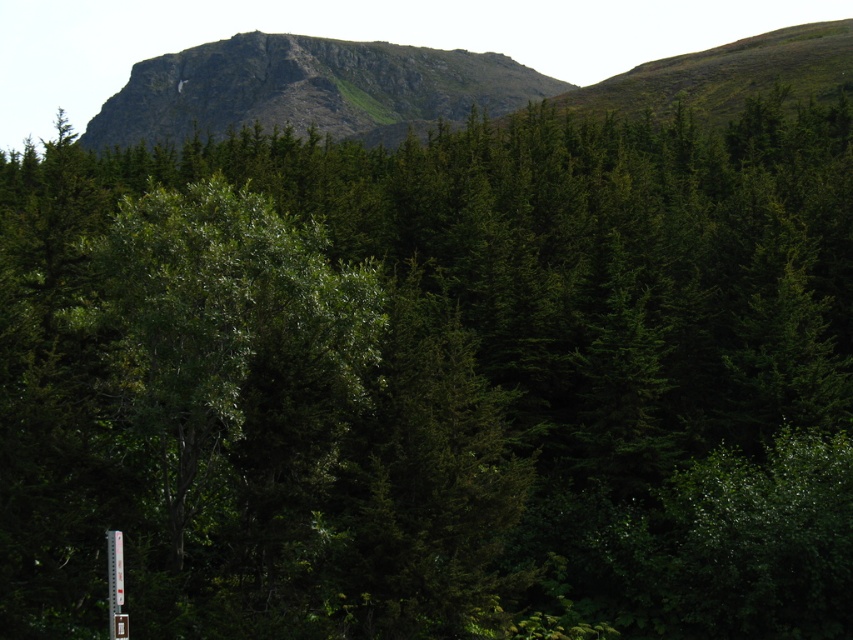
Measure the distance between point (491, 99) and camera.

212.80 meters

Does point (271, 65) lie behind point (119, 580)?

Yes.

Where is `rugged rock mountain at upper center`? rugged rock mountain at upper center is located at coordinates (310, 90).

Image resolution: width=853 pixels, height=640 pixels. Identify the location of rugged rock mountain at upper center. (310, 90).